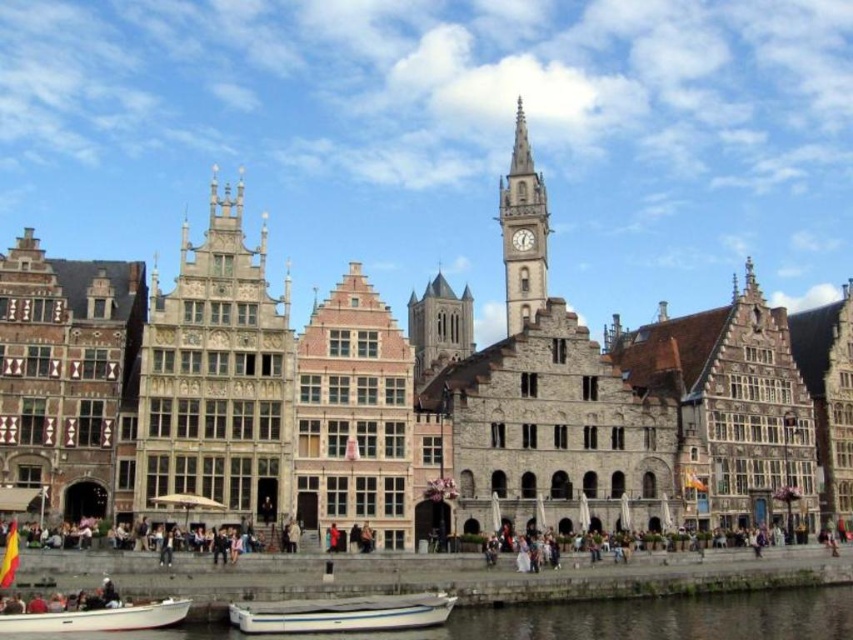
You are planning to take a photo of the stone textured building at center from the white matte boat at lower left. Given that the recommended minimum distance for clear photography is 150 feet, will you be able to capture a clear image from this position?

The stone textured building at center and white matte boat at lower left are 179.72 feet apart from each other. Since 179.72 feet exceeds the recommended minimum distance of 150 feet, you can capture a clear image from this position.

You are a tour guide leading a group along the riverside path. You want to inform your group about the distance between the stone carved tower at center and the white smooth water at lower center. What do you tell them?

The stone carved tower at center is 91.96 feet away from the white smooth water at lower center.

You are a tourist standing on the riverside path. You want to take a photo of the stone carved tower at center and the white smooth water at lower center. To ensure both are in the frame, should you position yourself to the left or right of the tower?

You should position yourself to the right of the stone carved tower at center because it is to the left of the white smooth water at lower center, so placing yourself to the right of the tower will allow both objects to be captured in the same frame.